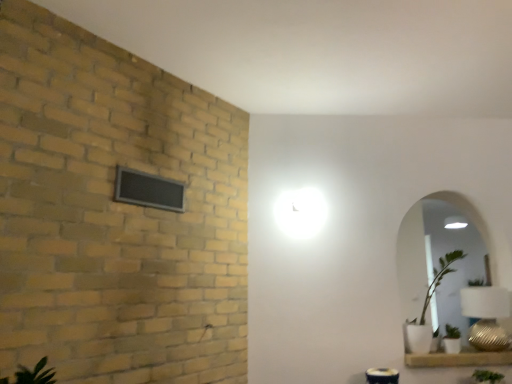
Question: Is gold textured table lamp at lower right next to white glossy mirror at right?

Choices:
 (A) yes
 (B) no

Answer: (B)

Question: Can you confirm if gold textured table lamp at lower right is bigger than white glossy mirror at right?

Choices:
 (A) no
 (B) yes

Answer: (A)

Question: Is the depth of gold textured table lamp at lower right greater than that of white glossy mirror at right?

Choices:
 (A) no
 (B) yes

Answer: (A)

Question: Is gold textured table lamp at lower right thinner than white glossy mirror at right?

Choices:
 (A) yes
 (B) no

Answer: (B)

Question: Does gold textured table lamp at lower right have a smaller size compared to white glossy mirror at right?

Choices:
 (A) no
 (B) yes

Answer: (B)

Question: Can you confirm if gold textured table lamp at lower right is wider than white glossy mirror at right?

Choices:
 (A) no
 (B) yes

Answer: (B)

Question: From the image's perspective, is black mesh window at upper left above white glossy mirror at right?

Choices:
 (A) yes
 (B) no

Answer: (A)

Question: Is black mesh window at upper left not inside white glossy mirror at right?

Choices:
 (A) no
 (B) yes

Answer: (B)

Question: Does black mesh window at upper left lie in front of white glossy mirror at right?

Choices:
 (A) yes
 (B) no

Answer: (A)

Question: Considering the relative sizes of black mesh window at upper left and white glossy mirror at right in the image provided, is black mesh window at upper left shorter than white glossy mirror at right?

Choices:
 (A) yes
 (B) no

Answer: (A)

Question: Is black mesh window at upper left at the right side of white glossy mirror at right?

Choices:
 (A) yes
 (B) no

Answer: (B)

Question: Can you confirm if black mesh window at upper left is positioned to the left of white glossy mirror at right?

Choices:
 (A) no
 (B) yes

Answer: (B)

Question: Is white ceramic window sill at lower right facing away from black mesh window at upper left?

Choices:
 (A) no
 (B) yes

Answer: (A)